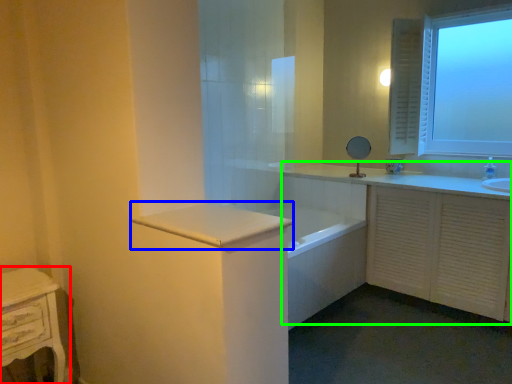
Question: Estimate the real-world distances between objects in this image. Which object is farther from nightstand (highlighted by a red box), counter top (highlighted by a blue box) or bathroom cabinet (highlighted by a green box)?

Choices:
 (A) counter top
 (B) bathroom cabinet

Answer: (B)